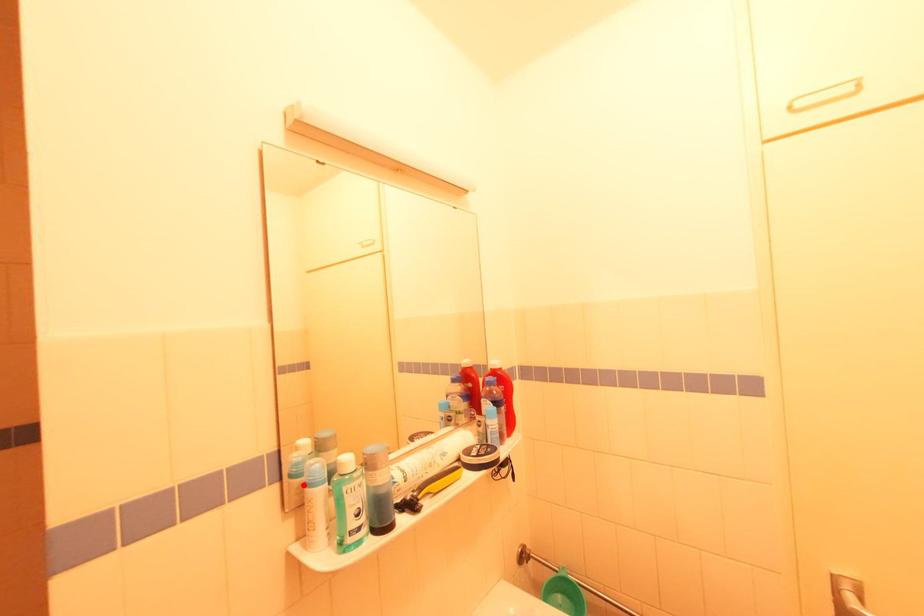
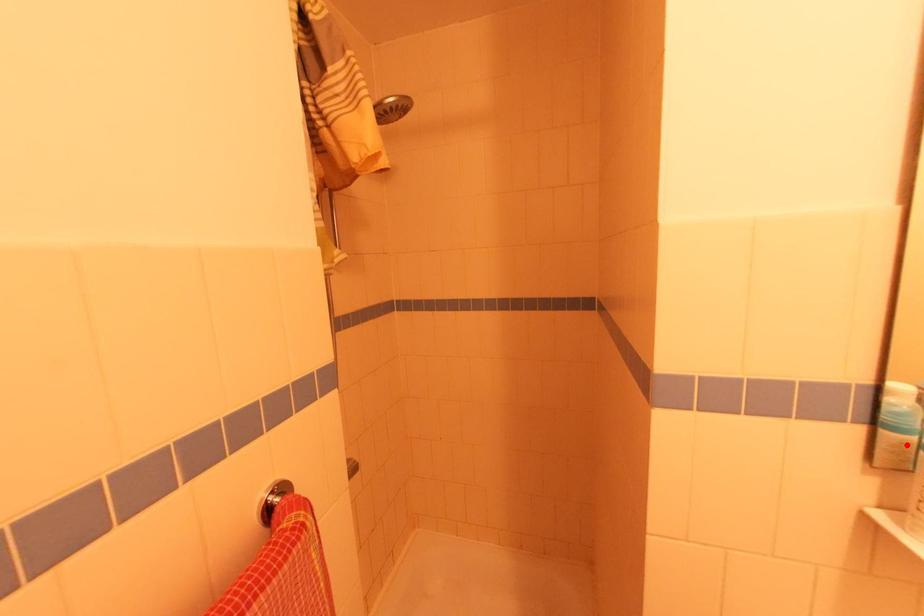
I am providing you with two images of the same scene from different viewpoints. A red point is marked on the first image and another point is marked on the second image. Do the highlighted points in image1 and image2 indicate the same real-world spot?

Yes